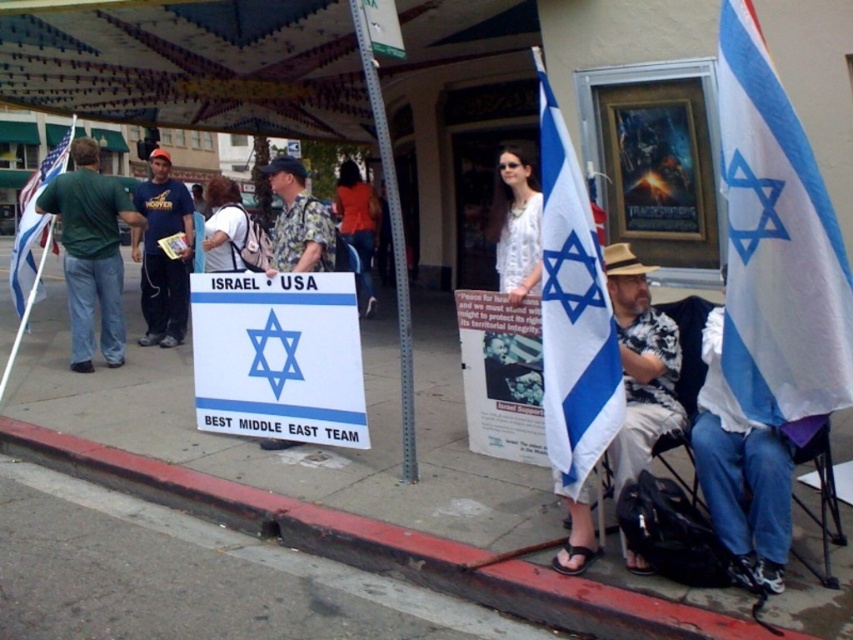
You are a photographer trying to capture both the white fabric at lower right and the white fabric flag at left in a single frame. Given their sizes, which object should you focus on to ensure both are visible without cropping?

Since the white fabric at lower right is smaller than the white fabric flag at left, you should focus on the white fabric flag at left to ensure both objects are visible without cropping, as it is larger and can be positioned centrally while the smaller one remains in frame.

Looking at this image, what is located at the point with coordinates (x=572, y=310) in the image?

The point at coordinates (x=572, y=310) is occupied by a blue and white fabric flag at center.